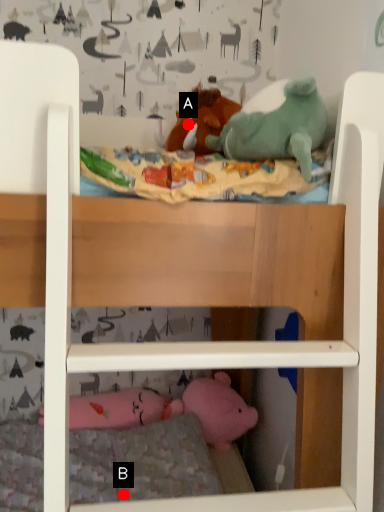
Question: Two points are circled on the image, labeled by A and B beside each circle. Which point is farther to the camera?

Choices:
 (A) A is further
 (B) B is further

Answer: (A)